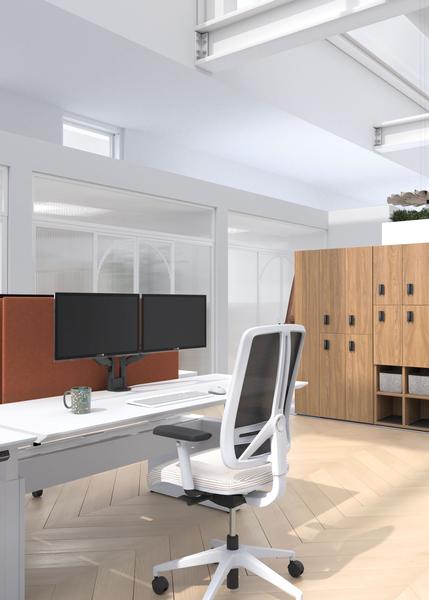
Locate an element on the screen. This screenshot has height=600, width=429. plant is located at coordinates (404, 212).